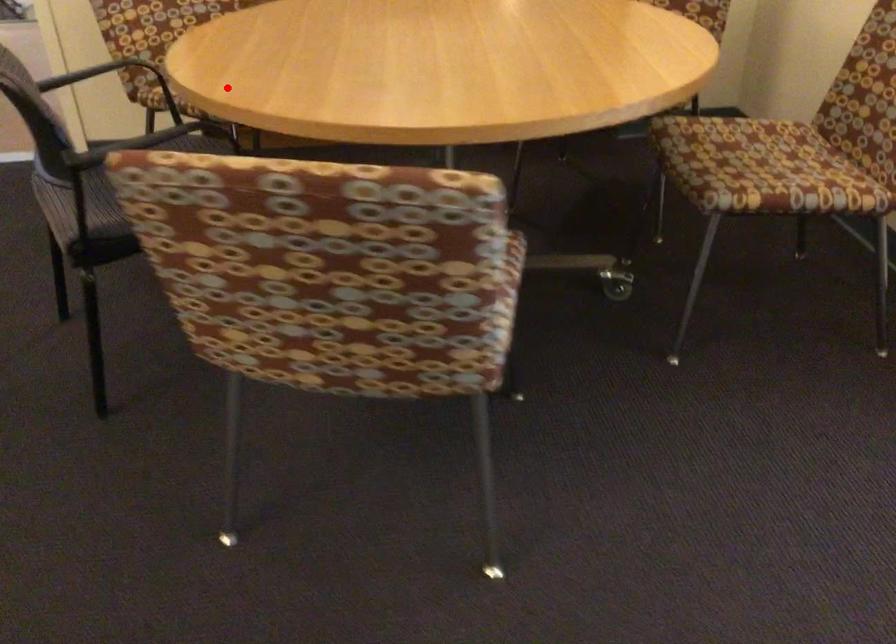
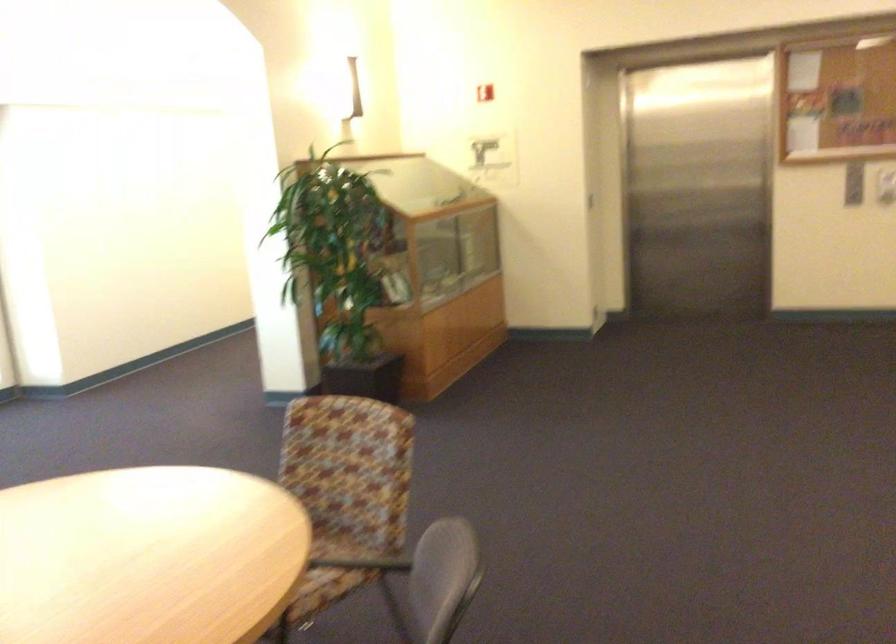
Question: I am providing you with two images of the same scene from different viewpoints. Given a red point in image1, look at the same physical point in image2. Is it:

Choices:
 (A) Closer to the viewpoint
 (B) Farther from the viewpoint

Answer: (B)